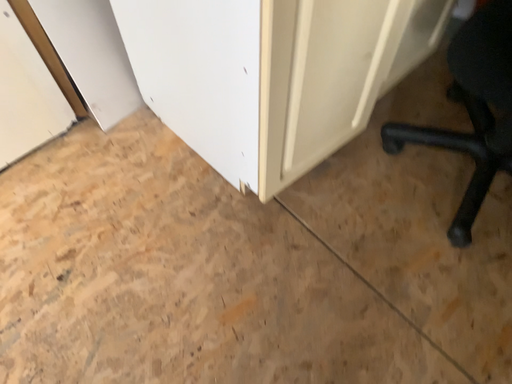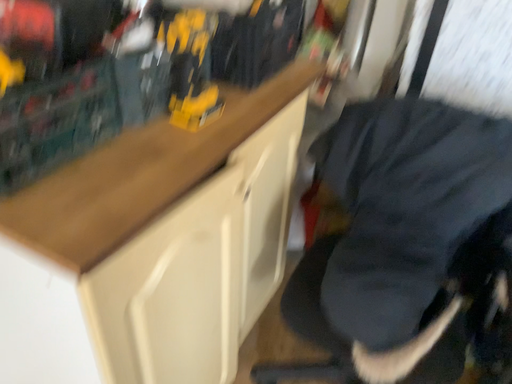
Question: How did the camera likely rotate when shooting the video?

Choices:
 (A) rotated upward
 (B) rotated downward

Answer: (A)